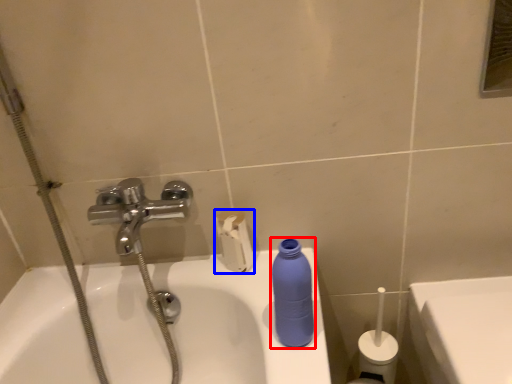
Question: Which object is closer to the camera taking this photo, cleaning product (highlighted by a red box) or toilet paper (highlighted by a blue box)?

Choices:
 (A) cleaning product
 (B) toilet paper

Answer: (A)